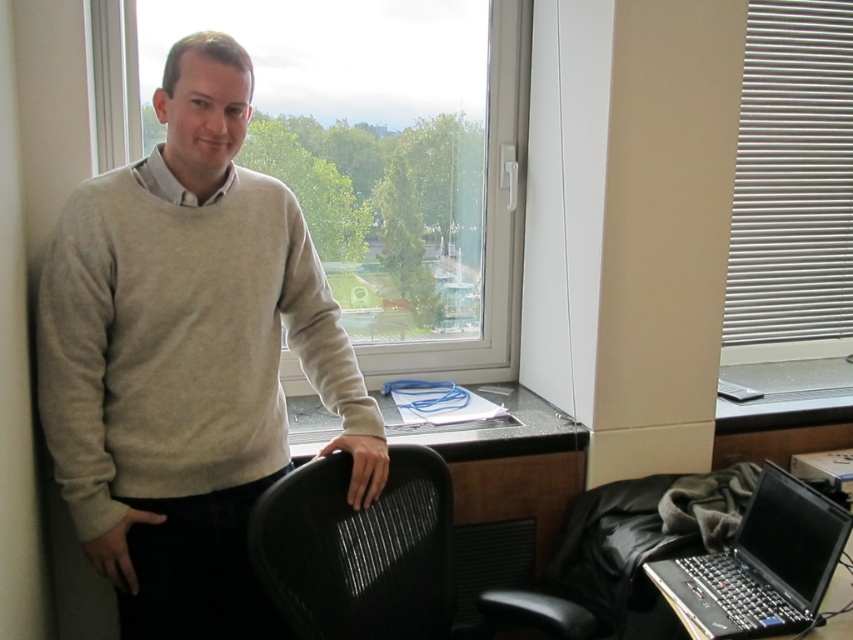
Question: Is white plastic blinds at right thinner than black mesh chair at center?

Choices:
 (A) no
 (B) yes

Answer: (B)

Question: Is white plastic blinds at right further to the viewer compared to black mesh chair at center?

Choices:
 (A) yes
 (B) no

Answer: (A)

Question: Which point appears closest to the camera in this image?

Choices:
 (A) (659, 588)
 (B) (798, 339)

Answer: (A)

Question: Which point appears farthest from the camera in this image?

Choices:
 (A) (105, 24)
 (B) (337, 467)

Answer: (A)

Question: Is beige sweater at center further to the viewer compared to white plastic blinds at right?

Choices:
 (A) no
 (B) yes

Answer: (A)

Question: Which object appears closest to the camera in this image?

Choices:
 (A) black plastic laptop at lower right
 (B) transparent glass window at upper center
 (C) white plastic blinds at right
 (D) beige sweater at center

Answer: (A)